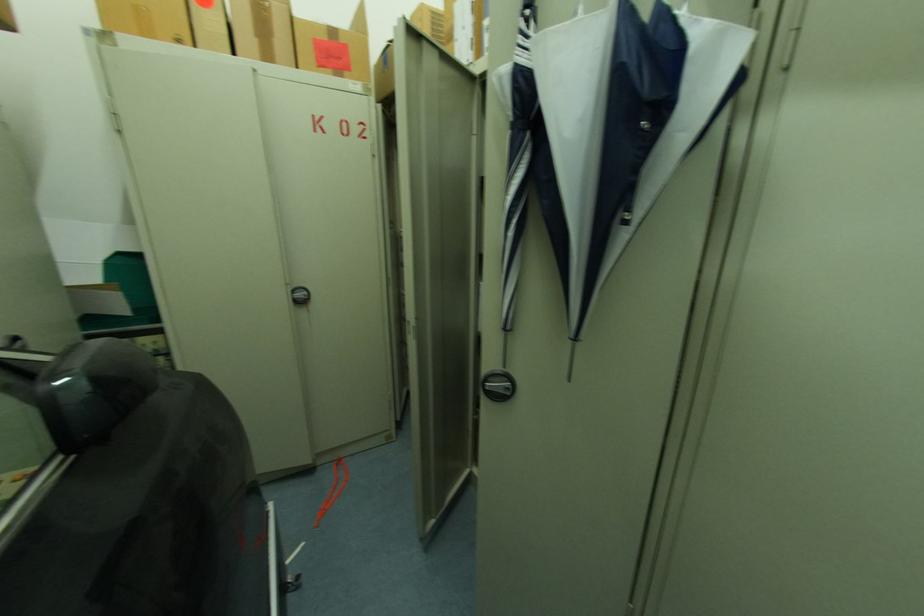
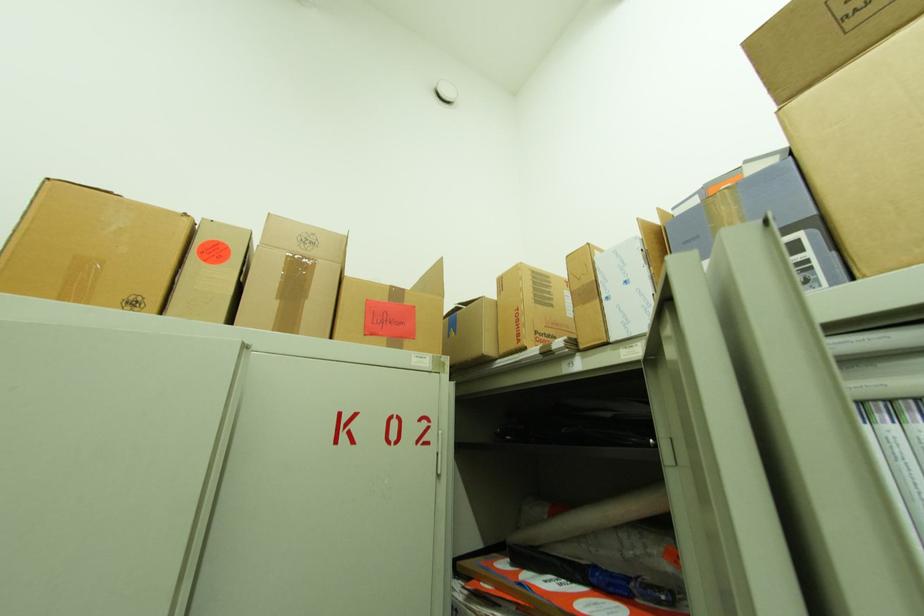
Question: The images are taken continuously from a first-person perspective. In which direction is your viewpoint rotating?

Choices:
 (A) Left
 (B) Right
 (C) Up
 (D) Down

Answer: (C)